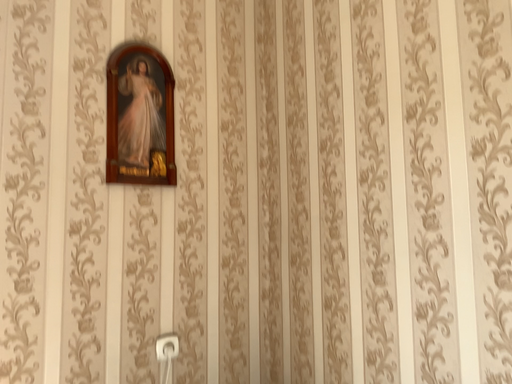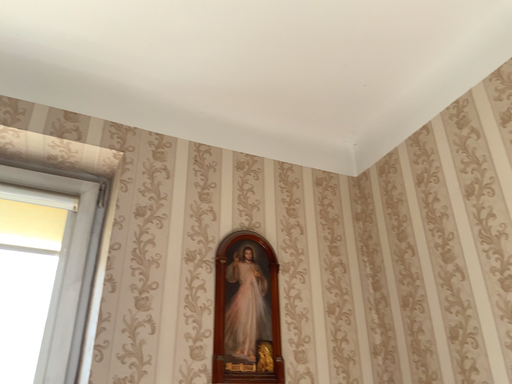
Question: How did the camera likely rotate when shooting the video?

Choices:
 (A) rotated right
 (B) rotated left

Answer: (B)